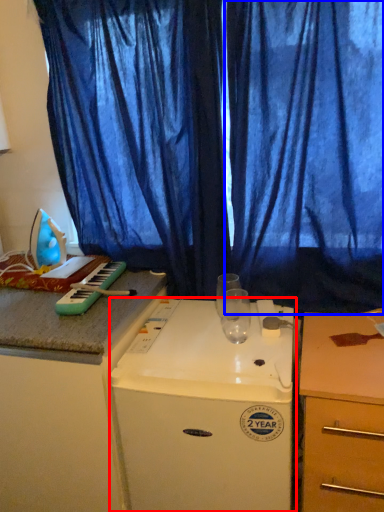
Question: Which of the following is the farthest to the observer, home appliance (highlighted by a red box) or curtain (highlighted by a blue box)?

Choices:
 (A) home appliance
 (B) curtain

Answer: (B)